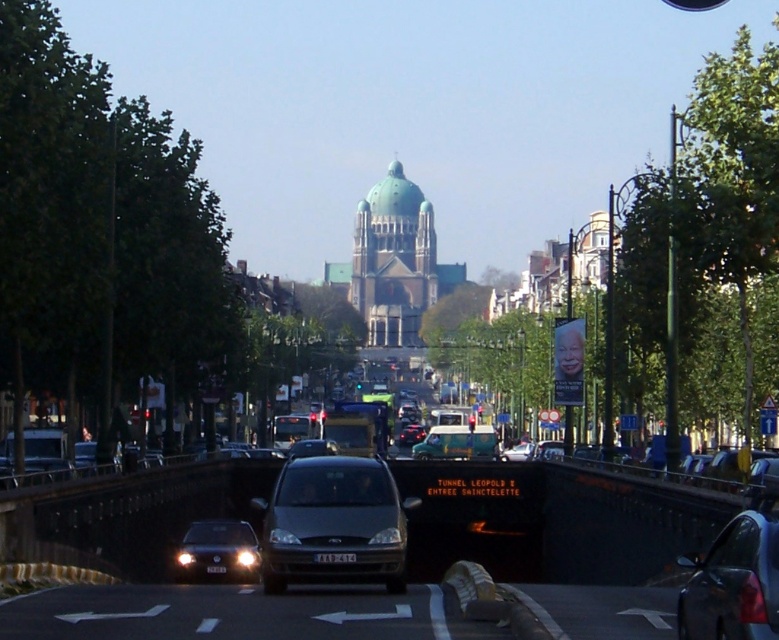
You are a delivery driver needing to park your vehicle in a space that can accommodate both the matte gray van at center and the metallic gray van at center side by side. Given the parking space is 6 meters wide, will both vans fit if placed next to each other?

The matte gray van at center is larger in size than the metallic gray van at center. Since the total width of both vans combined would exceed the 6 meters parking space, they cannot fit side by side.